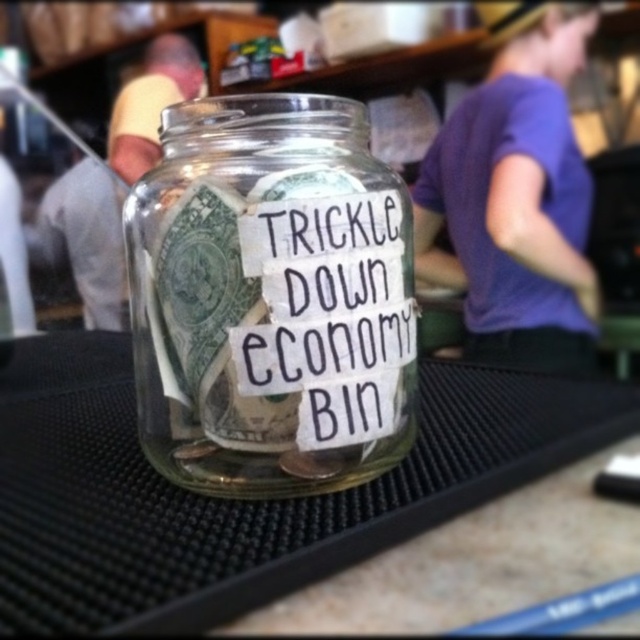
You are holding a camera and want to take a closeup photo of the transparent glass jar at center. The camera requires a minimum distance of 6 inches to focus properly. Can you take the photo without moving the jar?

The transparent glass jar at center and camera are 7.08 inches apart, which is more than the required 6 inches. Therefore, you can take the photo without moving the jar as the distance is sufficient for proper focus.

You are a customer at a cafe who wants to donate money to the jar labeled as a TRICKLE DOWN economy BIN. Can you see the contents inside the transparent glass jar at center through the white paper label at center?

The transparent glass jar at center is positioned over the white paper label at center, so yes, you can see the contents inside the transparent glass jar at center through the white paper label at center because the jar is above the label and both are transparent.

You are standing in front of the glass jar on the counter. If you want to reach the point labeled as point (314, 294), which is 7.45 inches away from you, can you estimate how far you need to stretch your hand to touch it?

The point labeled as point (314, 294) is 7.45 inches away from the viewer, so you would need to stretch your hand approximately 7.45 inches to touch it.